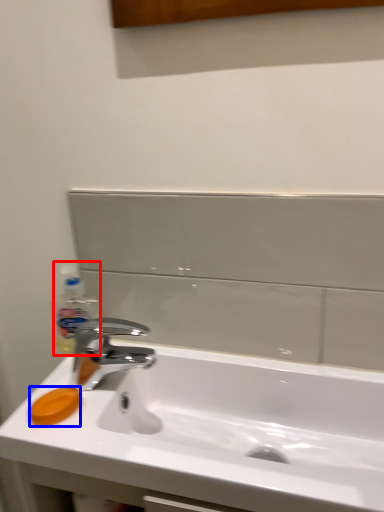
Question: Which point is closer to the camera, bottle (highlighted by a red box) or soap (highlighted by a blue box)?

Choices:
 (A) bottle
 (B) soap

Answer: (B)